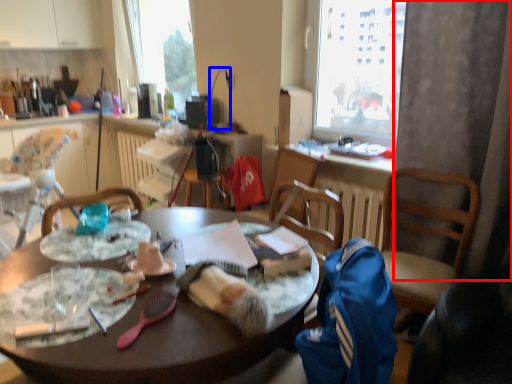
Question: Which of the following is the farthest to the observer, curtain (highlighted by a red box) or lamp (highlighted by a blue box)?

Choices:
 (A) curtain
 (B) lamp

Answer: (B)